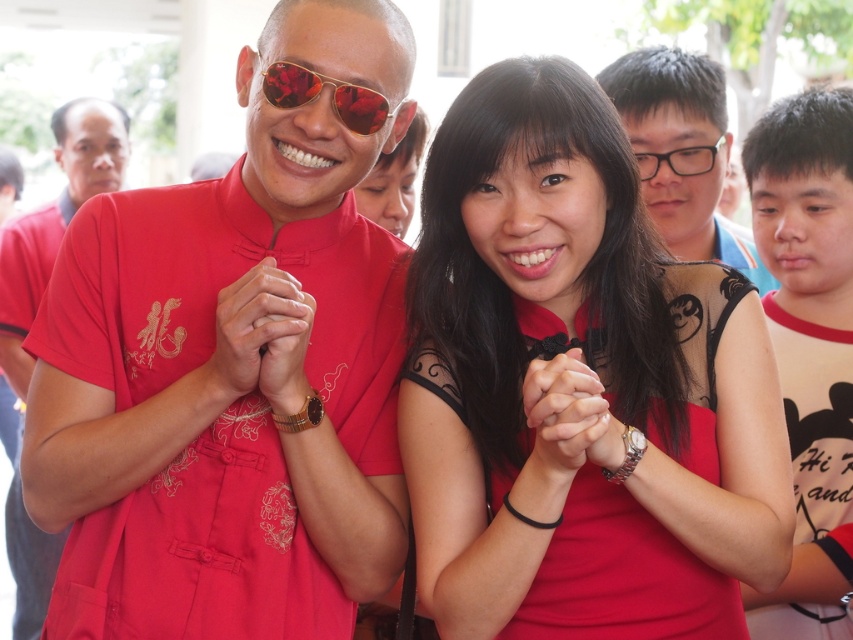
You are a photographer at the event and want to take a closeup of the matte red shirt at center without the transparent plastic glasses at upper right appearing in the background. Is this possible given their positions?

The matte red shirt at center is closer to the viewer than the transparent plastic glasses at upper right, so yes, the photographer can take a closeup of the matte red shirt at center without the transparent plastic glasses at upper right appearing in the background by focusing on the foreground subject.